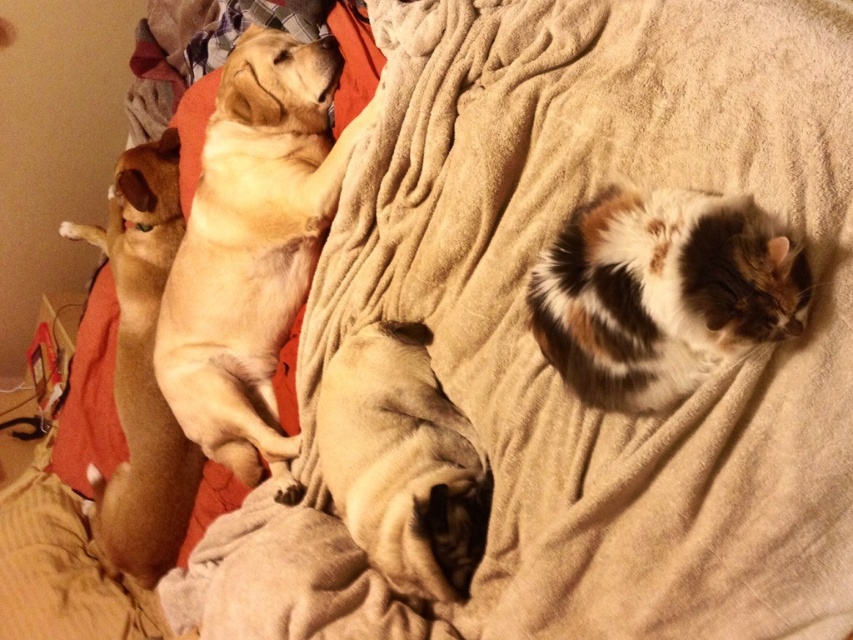
Is the position of golden fur dog at center more distant than that of brown soft pug at center?

Yes, it is.

Between golden fur dog at center and brown soft pug at center, which one is positioned lower?

brown soft pug at center

This screenshot has width=853, height=640. What are the coordinates of `golden fur dog at center` in the screenshot? It's located at (252, 248).

Can you confirm if brown soft pug at center is wider than brown furry dog at left?

Incorrect, brown soft pug at center's width does not surpass brown furry dog at left's.

Which is more to the right, brown soft pug at center or brown furry dog at left?

From the viewer's perspective, brown soft pug at center appears more on the right side.

Who is more distant from viewer, (387, 326) or (143, 330)?

The point (143, 330) is behind.

The image size is (853, 640). What are the coordinates of `brown soft pug at center` in the screenshot? It's located at (402, 461).

Who is positioned more to the right, golden fur dog at center or brown furry dog at left?

Positioned to the right is golden fur dog at center.

Can you confirm if golden fur dog at center is positioned to the left of brown furry dog at left?

In fact, golden fur dog at center is to the right of brown furry dog at left.

Who is more forward, (259, 428) or (160, 225)?

Point (259, 428)

Identify the location of golden fur dog at center. This screenshot has width=853, height=640. (252, 248).